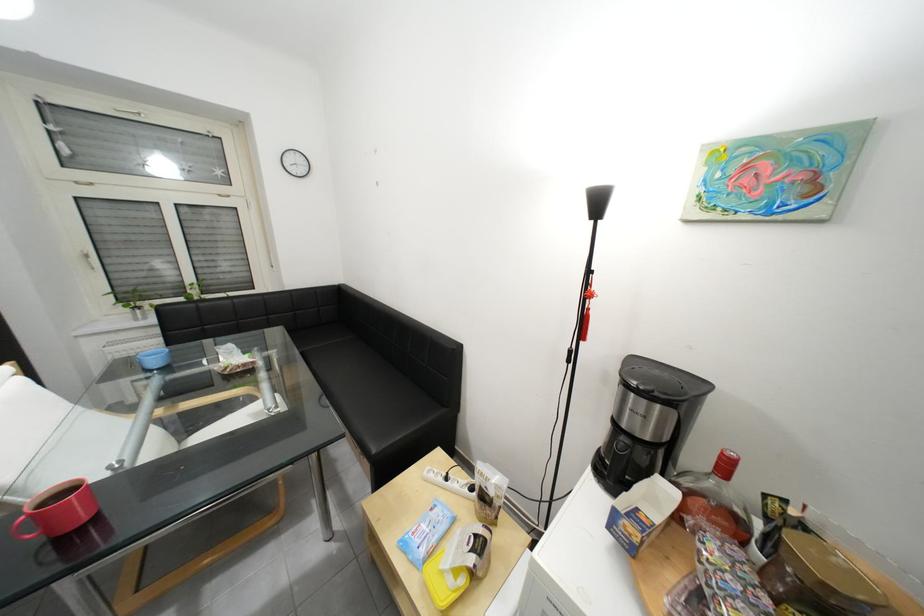
Which object does [714,498] point to?

This point indicates the glass liquor bottle.